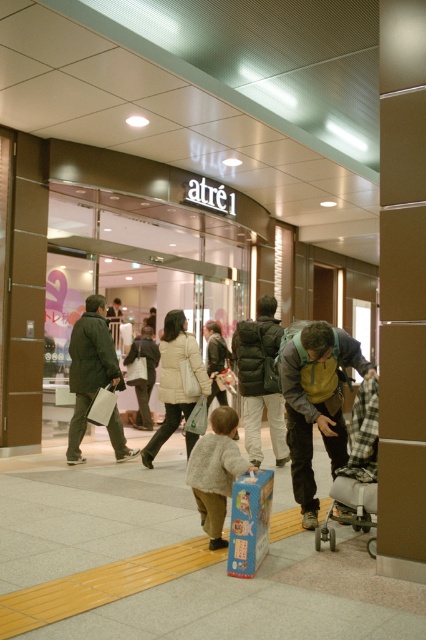
Between matte black puffer jacket at center and beige puffy coat at center, which one appears on the right side from the viewer's perspective?

From the viewer's perspective, matte black puffer jacket at center appears more on the right side.

Which is behind, point (284, 452) or point (201, 355)?

The point (284, 452) is behind.

Find the location of a particular element. matte black puffer jacket at center is located at coordinates (259, 380).

Is yellow backpack at lower right further to camera compared to dark green jacket at left?

No, yellow backpack at lower right is in front of dark green jacket at left.

Find the location of a particular element. yellow backpack at lower right is located at coordinates (316, 403).

Which is more to the right, light gray wool sweater at center or beige puffy coat at center?

From the viewer's perspective, light gray wool sweater at center appears more on the right side.

Can you confirm if light gray wool sweater at center is thinner than beige puffy coat at center?

Yes.

This screenshot has width=426, height=640. What are the coordinates of `light gray wool sweater at center` in the screenshot? It's located at (215, 472).

Find the location of a particular element. light gray wool sweater at center is located at coordinates (215, 472).